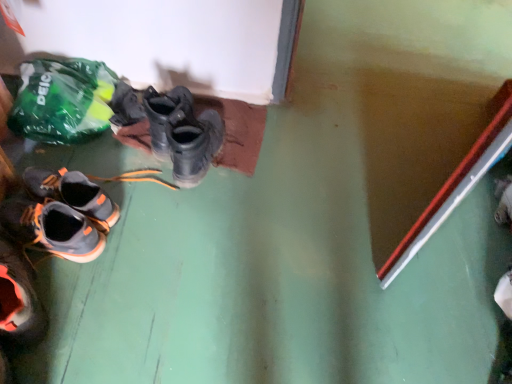
Question: Does green plastic bag at upper left touch matte black boots at center?

Choices:
 (A) no
 (B) yes

Answer: (A)

Question: From the image's perspective, is green plastic bag at upper left located beneath matte black boots at center?

Choices:
 (A) no
 (B) yes

Answer: (A)

Question: Is green plastic bag at upper left turned away from matte black boots at center?

Choices:
 (A) yes
 (B) no

Answer: (B)

Question: Is green plastic bag at upper left completely or partially outside of matte black boots at center?

Choices:
 (A) yes
 (B) no

Answer: (A)

Question: Is green plastic bag at upper left to the left of matte black boots at center from the viewer's perspective?

Choices:
 (A) yes
 (B) no

Answer: (A)

Question: Is green plastic bag at upper left wider than matte black boots at center?

Choices:
 (A) yes
 (B) no

Answer: (B)

Question: From the image's perspective, is matte black boots at center located beneath gray suede shoes at lower left?

Choices:
 (A) yes
 (B) no

Answer: (B)

Question: Is matte black boots at center facing towards gray suede shoes at lower left?

Choices:
 (A) no
 (B) yes

Answer: (A)

Question: Could gray suede shoes at lower left be considered to be inside matte black boots at center?

Choices:
 (A) no
 (B) yes

Answer: (A)

Question: Considering the relative sizes of matte black boots at center and gray suede shoes at lower left in the image provided, is matte black boots at center thinner than gray suede shoes at lower left?

Choices:
 (A) yes
 (B) no

Answer: (A)

Question: Considering the relative positions of matte black boots at center and gray suede shoes at lower left in the image provided, is matte black boots at center to the right of gray suede shoes at lower left from the viewer's perspective?

Choices:
 (A) no
 (B) yes

Answer: (B)

Question: Is matte black boots at center with gray suede shoes at lower left?

Choices:
 (A) yes
 (B) no

Answer: (B)

Question: Does gray suede shoes at lower left have a smaller size compared to matte black boots at center?

Choices:
 (A) no
 (B) yes

Answer: (A)